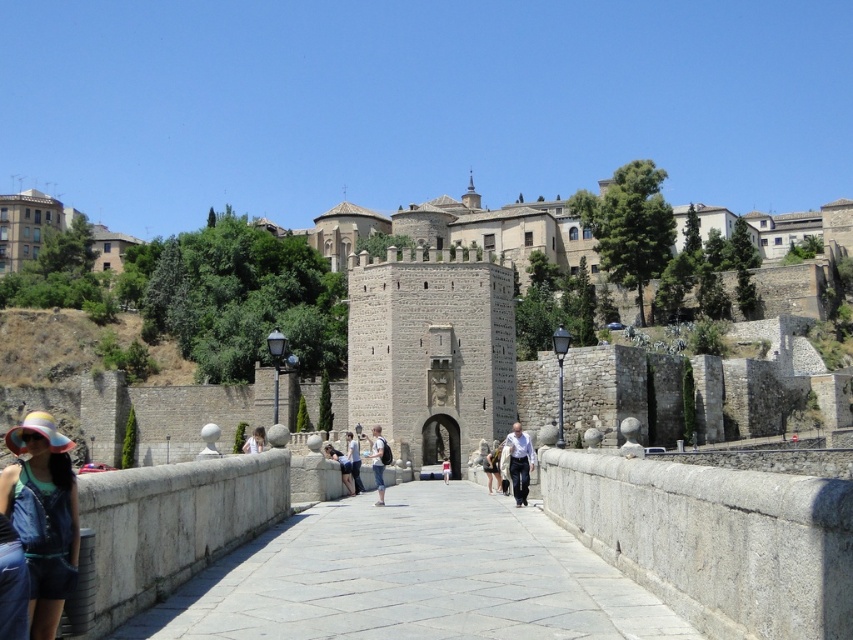
Does denim jacket at center appear over light blue denim jacket at center?

Correct, denim jacket at center is located above light blue denim jacket at center.

At what (x,y) coordinates should I click in order to perform the action: click on denim jacket at center. Please return your answer as a coordinate pair (x, y). This screenshot has width=853, height=640. Looking at the image, I should click on (354, 460).

Does multicolored fabric hat at lower left appear on the left side of denim jacket at center?

Indeed, multicolored fabric hat at lower left is positioned on the left side of denim jacket at center.

Between multicolored fabric hat at lower left and denim jacket at center, which one is positioned lower?

denim jacket at center is below.

Is point (22, 532) farther from viewer compared to point (357, 460)?

No, (22, 532) is closer to viewer.

Locate an element on the screen. The width and height of the screenshot is (853, 640). multicolored fabric hat at lower left is located at coordinates (x=44, y=515).

Can you confirm if denim jeans at center is positioned below light blue denim jacket at center?

No.

Who is lower down, denim jeans at center or light blue denim jacket at center?

light blue denim jacket at center is lower down.

The height and width of the screenshot is (640, 853). What do you see at coordinates (378, 460) in the screenshot?
I see `denim jeans at center` at bounding box center [378, 460].

Find the location of a particular element. The height and width of the screenshot is (640, 853). denim jeans at center is located at coordinates (378, 460).